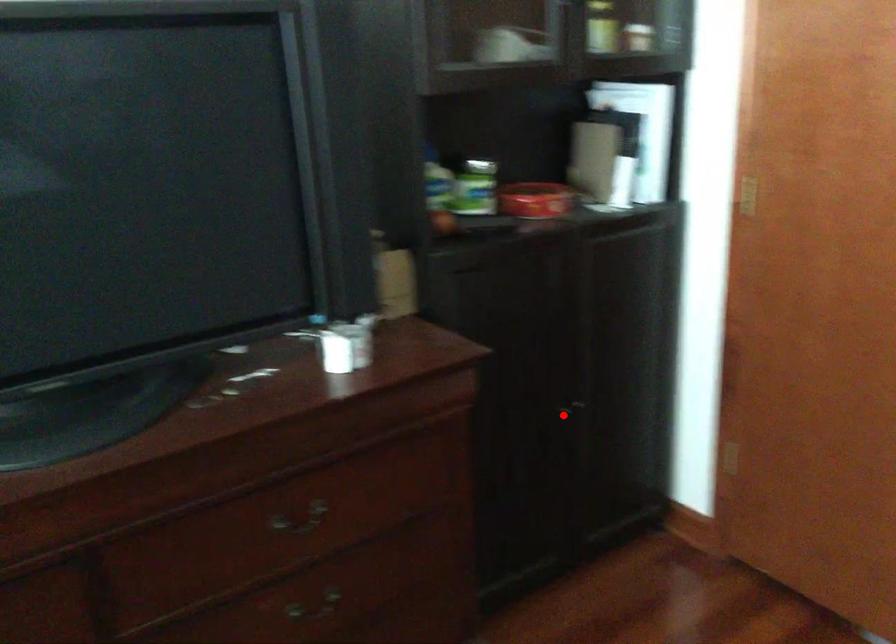
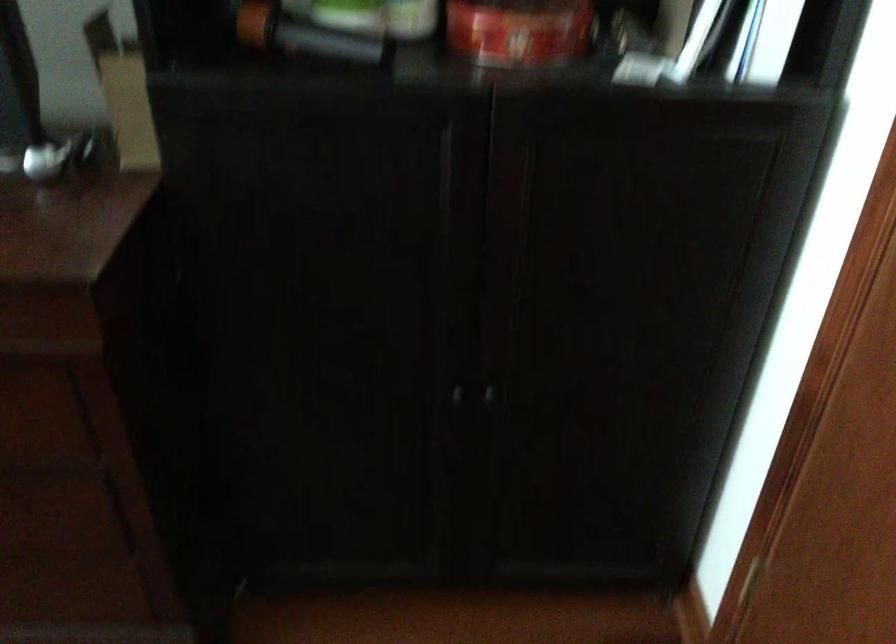
The point at the highlighted location is marked in the first image. Where is the corresponding point in the second image?

(457, 395)